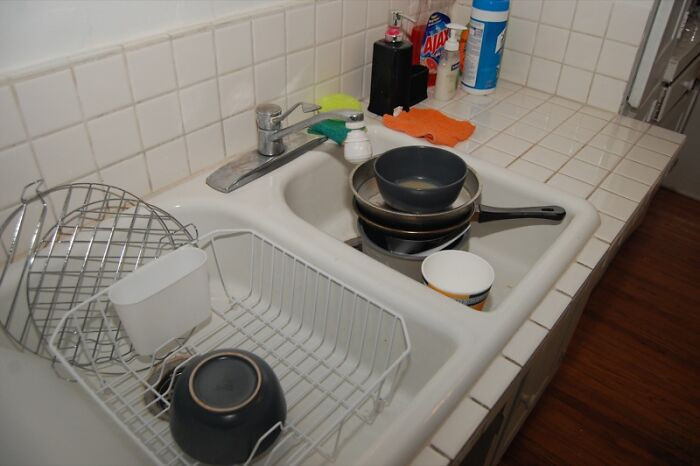
I want to click on sponge, so click(x=342, y=104).